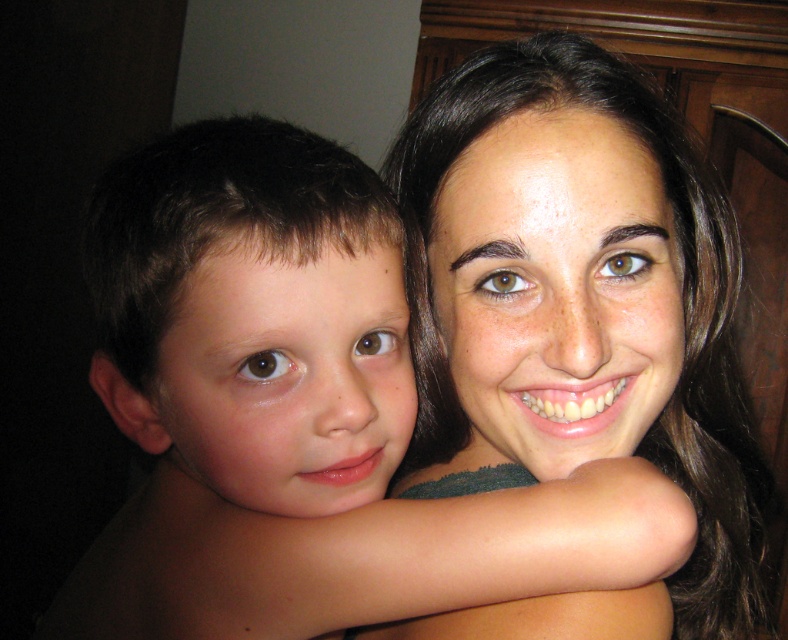
Question: Can you confirm if smooth skin child at center is smaller than smooth skin face at upper right?

Choices:
 (A) yes
 (B) no

Answer: (A)

Question: Which point appears farthest from the camera in this image?

Choices:
 (A) (675, 204)
 (B) (199, 483)

Answer: (A)

Question: Can you confirm if smooth skin child at center is wider than smooth skin face at upper right?

Choices:
 (A) yes
 (B) no

Answer: (B)

Question: Does smooth skin child at center appear over smooth skin face at upper right?

Choices:
 (A) no
 (B) yes

Answer: (B)

Question: Which object is closer to the camera taking this photo?

Choices:
 (A) smooth skin child at center
 (B) smooth skin face at upper right

Answer: (A)

Question: Which object appears closest to the camera in this image?

Choices:
 (A) smooth skin face at upper right
 (B) smooth skin child at center

Answer: (B)